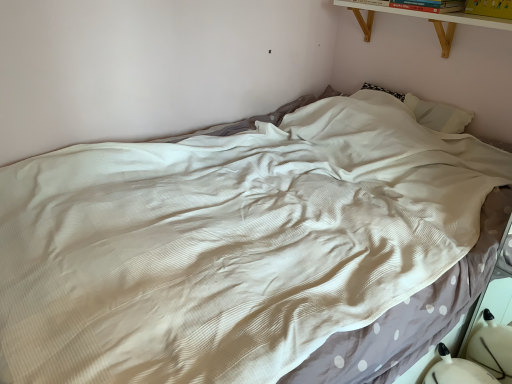
Question: Would you say yellow paper at upper right, the 1th book from the right, is to the left or to the right of white wood shelf at upper right in the picture?

Choices:
 (A) left
 (B) right

Answer: (B)

Question: Looking at the image, does yellow paper at upper right, which is counted as the 2th book, starting from the left, seem bigger or smaller compared to white wood shelf at upper right?

Choices:
 (A) big
 (B) small

Answer: (B)

Question: Which object is positioned farthest from the white fabric swivel chair at lower right?

Choices:
 (A) yellow paper at upper right, which is counted as the 2th book, starting from the left
 (B) hardcover book at upper right, the 2th book positioned from the right
 (C) white wood shelf at upper right

Answer: (B)

Question: Based on their relative distances, which object is farther from the yellow paper at upper right, which is counted as the 2th book, starting from the left?

Choices:
 (A) hardcover book at upper right, arranged as the 1th book when viewed from the left
 (B) white fabric swivel chair at lower right
 (C) white wood shelf at upper right

Answer: (B)